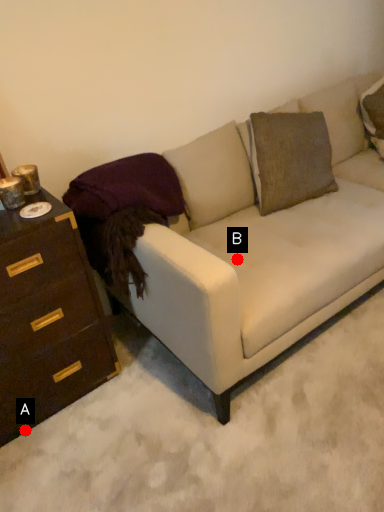
Question: Two points are circled on the image, labeled by A and B beside each circle. Which point appears farthest from the camera in this image?

Choices:
 (A) A is further
 (B) B is further

Answer: (B)